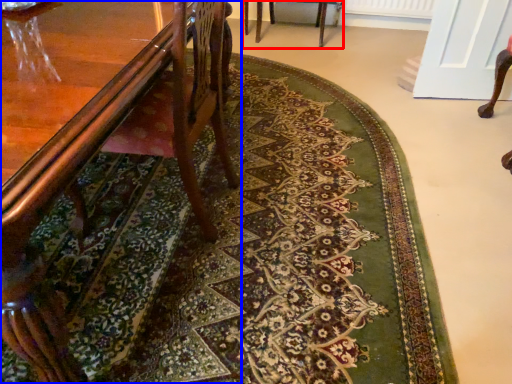
Question: Which point is further to the camera, chair (highlighted by a red box) or chair (highlighted by a blue box)?

Choices:
 (A) chair
 (B) chair

Answer: (A)